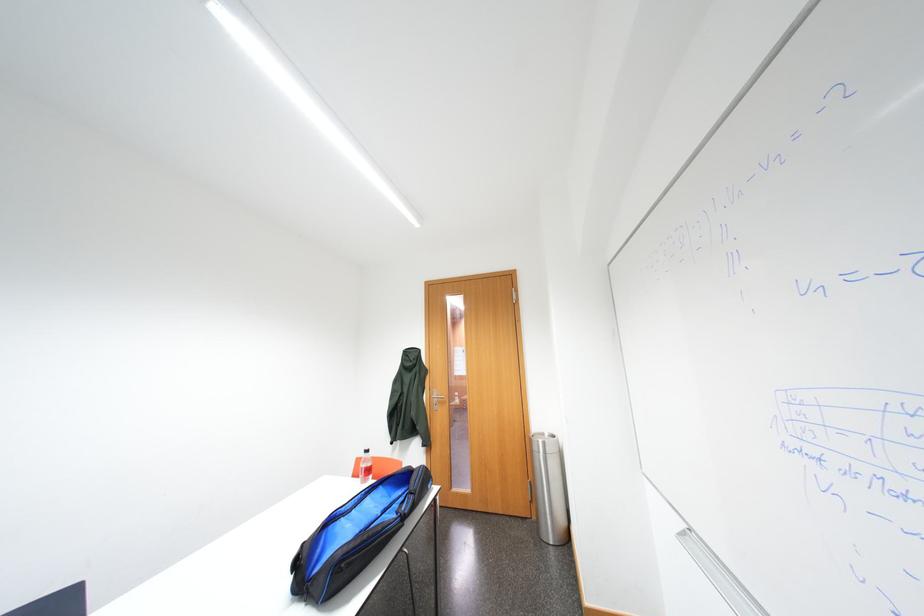
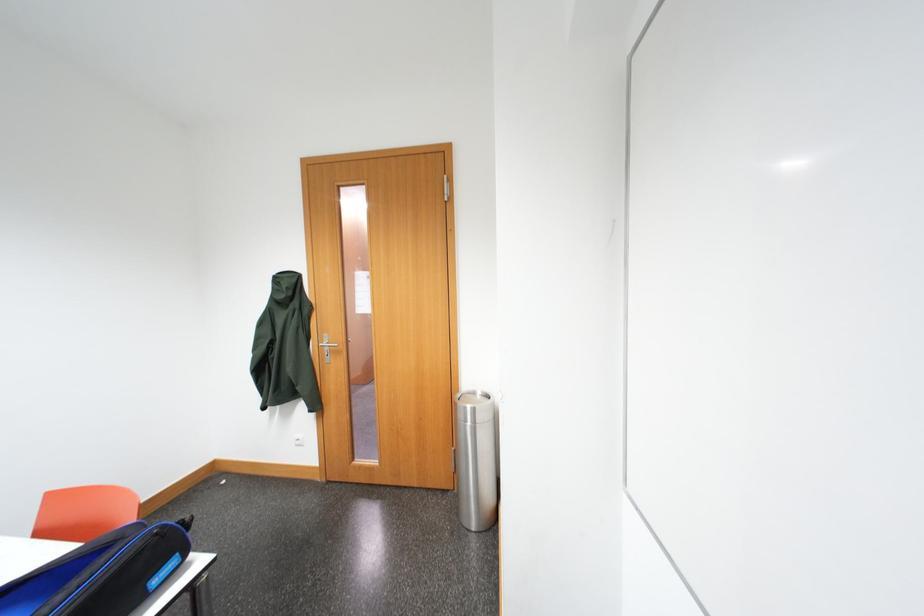
Question: The first image is from the beginning of the video and the second image is from the end. How did the camera likely rotate when shooting the video?

Choices:
 (A) Left
 (B) Right
 (C) Up
 (D) Down

Answer: (D)